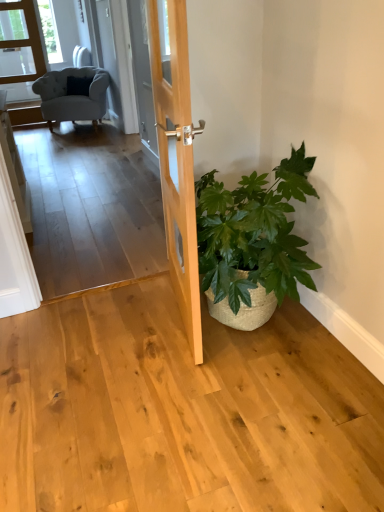
The image size is (384, 512). Find the location of `green woven basket at lower right`. green woven basket at lower right is located at coordinates (252, 242).

Locate an element on the screen. light gray fabric armchair at upper left is located at coordinates (72, 95).

You are a GUI agent. You are given a task and a screenshot of the screen. Output one action in this format:
    pyautogui.click(x=<x>, y=<y>)
    Task: Click on the transparent glass door at upper left
    Image resolution: width=384 pixels, height=512 pixels.
    Given the screenshot: What is the action you would take?
    pyautogui.click(x=19, y=50)

Considering the relative positions of green woven basket at lower right and light gray fabric armchair at upper left in the image provided, is green woven basket at lower right to the left or to the right of light gray fabric armchair at upper left?

green woven basket at lower right is positioned on light gray fabric armchair at upper left's right side.

Based on the photo, is green woven basket at lower right looking in the opposite direction of light gray fabric armchair at upper left?

No, light gray fabric armchair at upper left is not at the back of green woven basket at lower right.

Does green woven basket at lower right have a smaller size compared to light gray fabric armchair at upper left?

Yes.

From the image's perspective, which is below, green woven basket at lower right or light gray fabric armchair at upper left?

green woven basket at lower right appears lower in the image.

Is transparent glass door at upper left positioned with its back to light gray fabric armchair at upper left?

transparent glass door at upper left is not turned away from light gray fabric armchair at upper left.

From a real-world perspective, is transparent glass door at upper left below light gray fabric armchair at upper left?

No, from a real-world perspective, transparent glass door at upper left is not under light gray fabric armchair at upper left.

Visually, is transparent glass door at upper left positioned to the left or to the right of light gray fabric armchair at upper left?

transparent glass door at upper left is positioned on light gray fabric armchair at upper left's left side.

Is transparent glass door at upper left not within light gray fabric armchair at upper left?

Yes, transparent glass door at upper left is located beyond the bounds of light gray fabric armchair at upper left.

Which object is thinner, transparent glass door at upper left or green woven basket at lower right?

transparent glass door at upper left is thinner.

Which of these two, transparent glass door at upper left or green woven basket at lower right, is smaller?

With smaller size is transparent glass door at upper left.

Are transparent glass door at upper left and green woven basket at lower right making contact?

No.

Based on the photo, considering the sizes of green woven basket at lower right and transparent glass door at upper left in the image, is green woven basket at lower right wider or thinner than transparent glass door at upper left?

green woven basket at lower right is wider than transparent glass door at upper left.

Is green woven basket at lower right far away from transparent glass door at upper left?

That's right, there is a large distance between green woven basket at lower right and transparent glass door at upper left.

Is green woven basket at lower right smaller than transparent glass door at upper left?

Incorrect, green woven basket at lower right is not smaller in size than transparent glass door at upper left.

Considering the relative positions of green woven basket at lower right and transparent glass door at upper left in the image provided, is green woven basket at lower right to the left or to the right of transparent glass door at upper left?

From the image, it's evident that green woven basket at lower right is to the right of transparent glass door at upper left.

This screenshot has width=384, height=512. What are the coordinates of `door on the right side of light gray fabric armchair at upper left` in the screenshot? It's located at (176, 156).

Measure the distance between light brown wood door at center and light gray fabric armchair at upper left.

light brown wood door at center is 3.48 meters away from light gray fabric armchair at upper left.

From a real-world perspective, between light brown wood door at center and light gray fabric armchair at upper left, who is vertically higher?

In real-world perspective, light brown wood door at center is above.

Can you tell me how much light gray fabric armchair at upper left and green woven basket at lower right differ in facing direction?

The angular difference between light gray fabric armchair at upper left and green woven basket at lower right is 62.2 degrees.

From a real-world perspective, between light gray fabric armchair at upper left and green woven basket at lower right, who is vertically lower?

green woven basket at lower right, from a real-world perspective.

Is light gray fabric armchair at upper left positioned with its back to green woven basket at lower right?

light gray fabric armchair at upper left does not have its back to green woven basket at lower right.

This screenshot has height=512, width=384. What are the coordinates of `houseplant in front of the light gray fabric armchair at upper left` in the screenshot? It's located at (252, 242).

How different are the orientations of light gray fabric armchair at upper left and light brown wood door at center in degrees?

71.4 degrees separate the facing orientations of light gray fabric armchair at upper left and light brown wood door at center.

Are light gray fabric armchair at upper left and light brown wood door at center beside each other?

light gray fabric armchair at upper left and light brown wood door at center are clearly separated.

Is light gray fabric armchair at upper left surrounding light brown wood door at center?

No, light brown wood door at center is not inside light gray fabric armchair at upper left.

Does point (53, 115) come farther from viewer compared to point (186, 202)?

Yes.

The height and width of the screenshot is (512, 384). In order to click on chair above the green woven basket at lower right (from the image's perspective) in this screenshot , I will do `click(72, 95)`.

This screenshot has height=512, width=384. Find the location of `glass door on the left of light gray fabric armchair at upper left`. glass door on the left of light gray fabric armchair at upper left is located at coordinates (19, 50).

From the image, which object appears to be farther from light gray fabric armchair at upper left, transparent glass door at upper left or green woven basket at lower right?

green woven basket at lower right lies further to light gray fabric armchair at upper left than the other object.

When comparing their distances from transparent glass door at upper left, does light gray fabric armchair at upper left or green woven basket at lower right seem closer?

Based on the image, light gray fabric armchair at upper left appears to be nearer to transparent glass door at upper left.

Which object lies nearer to the anchor point green woven basket at lower right, transparent glass door at upper left or light gray fabric armchair at upper left?

light gray fabric armchair at upper left is closer to green woven basket at lower right.

Based on their spatial positions, is light brown wood door at center or light gray fabric armchair at upper left further from green woven basket at lower right?

The object further to green woven basket at lower right is light gray fabric armchair at upper left.

When comparing their distances from light brown wood door at center, does green woven basket at lower right or transparent glass door at upper left seem closer?

The object closer to light brown wood door at center is green woven basket at lower right.

From the image, which object appears to be nearer to light brown wood door at center, green woven basket at lower right or light gray fabric armchair at upper left?

green woven basket at lower right is closer to light brown wood door at center.

Estimate the real-world distances between objects in this image. Which object is further from light brown wood door at center, transparent glass door at upper left or green woven basket at lower right?

Based on the image, transparent glass door at upper left appears to be further to light brown wood door at center.

From the image, which object appears to be farther from light brown wood door at center, light gray fabric armchair at upper left or green woven basket at lower right?

Among the two, light gray fabric armchair at upper left is located further to light brown wood door at center.

The image size is (384, 512). I want to click on chair between green woven basket at lower right and transparent glass door at upper left from front to back, so click(72, 95).

The width and height of the screenshot is (384, 512). Identify the location of chair between light brown wood door at center and transparent glass door at upper left along the z-axis. (72, 95).

I want to click on houseplant between light brown wood door at center and light gray fabric armchair at upper left in the front-back direction, so click(252, 242).

Find the location of `houseplant between light brown wood door at center and transparent glass door at upper left from front to back`. houseplant between light brown wood door at center and transparent glass door at upper left from front to back is located at coordinates (252, 242).